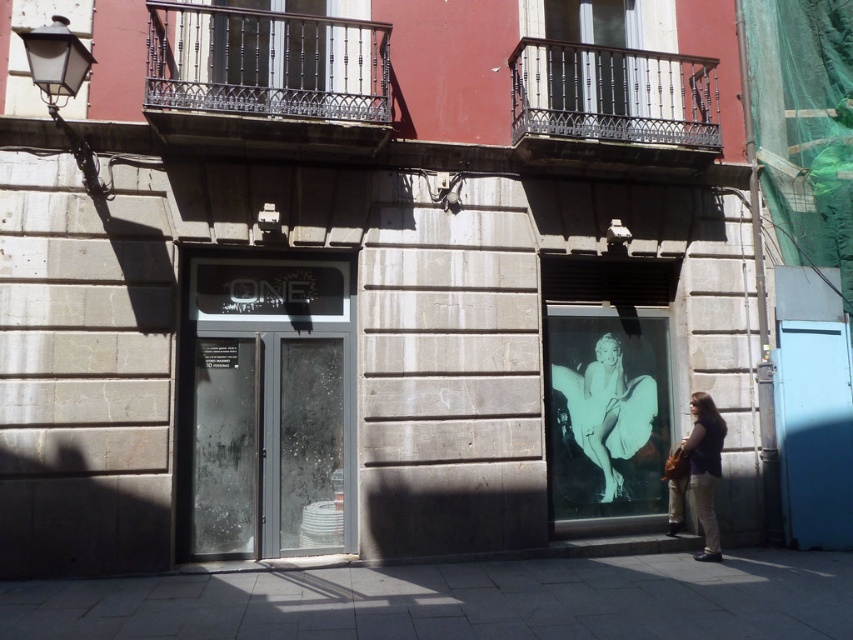
Question: Among these points, which one is farthest from the camera?

Choices:
 (A) (350, 604)
 (B) (610, 387)

Answer: (B)

Question: Which is nearer to the matte brown jacket at lower right?

Choices:
 (A) silvery metallic poster at center
 (B) transparent glass door at center

Answer: (A)

Question: Can you confirm if gray concrete pavement at lower center is thinner than transparent glass door at center?

Choices:
 (A) yes
 (B) no

Answer: (B)

Question: Can you confirm if gray concrete pavement at lower center is positioned to the left of silvery metallic poster at center?

Choices:
 (A) no
 (B) yes

Answer: (A)

Question: Which point appears farthest from the camera in this image?

Choices:
 (A) (347, 465)
 (B) (677, 630)
 (C) (621, 420)
 (D) (703, 538)

Answer: (C)

Question: Is gray concrete pavement at lower center thinner than matte brown jacket at lower right?

Choices:
 (A) no
 (B) yes

Answer: (A)